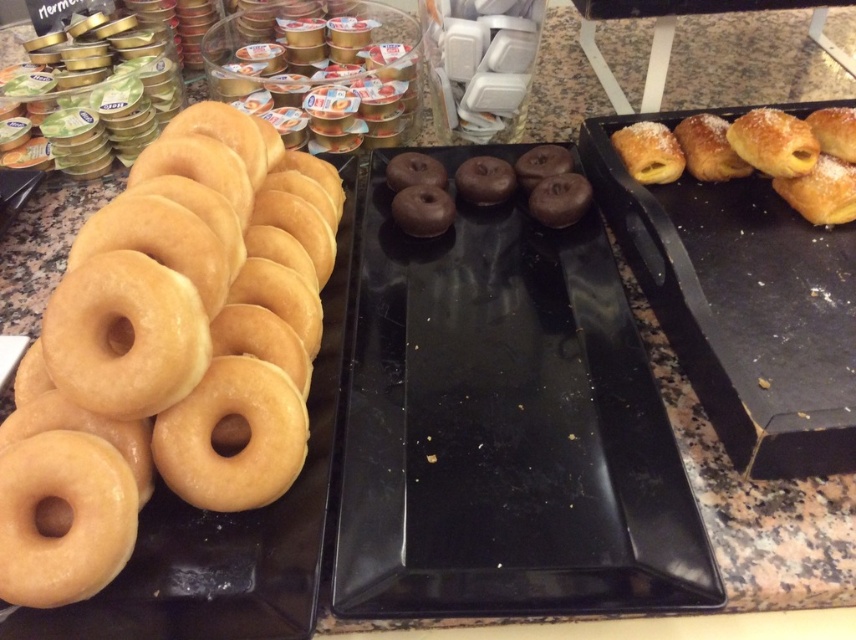
Question: Which object appears farthest from the camera in this image?

Choices:
 (A) glossy glazed donut at left
 (B) golden matte donut at left

Answer: (B)

Question: Can you confirm if glossy glazed donut at left is smaller than golden matte donut at left?

Choices:
 (A) no
 (B) yes

Answer: (A)

Question: Can you confirm if glossy glazed donut at left is positioned to the right of golden matte donut at left?

Choices:
 (A) yes
 (B) no

Answer: (A)

Question: Is glossy glazed donut at left to the right of golden matte donut at left from the viewer's perspective?

Choices:
 (A) yes
 (B) no

Answer: (A)